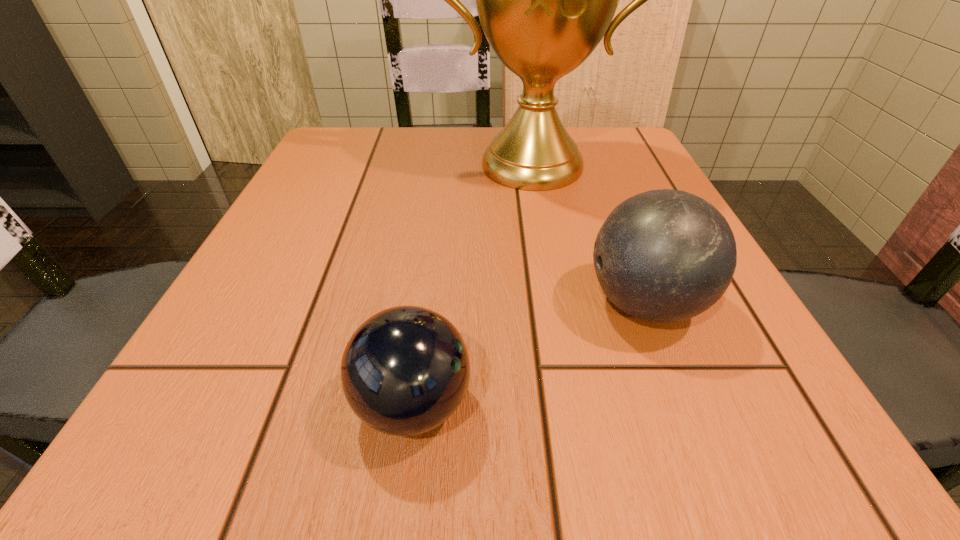
Identify the location of vacant space positioned 0.230m on the side of the nearest object with the finger holes. Image resolution: width=960 pixels, height=540 pixels. (669, 404).

You are a GUI agent. You are given a task and a screenshot of the screen. Output one action in this format:
    pyautogui.click(x=<x>, y=<y>)
    Task: Click on the object that is at the far edge
    The width and height of the screenshot is (960, 540).
    Given the screenshot: What is the action you would take?
    pyautogui.click(x=545, y=0)

Find the location of a particular element. The image size is (960, 540). object located in the near edge section of the desktop is located at coordinates (405, 370).

This screenshot has height=540, width=960. I want to click on trophy cup at the right edge, so click(x=545, y=0).

Find the location of a particular element. Image resolution: width=960 pixels, height=540 pixels. bowling ball that is at the right edge is located at coordinates (665, 255).

At what (x,y) coordinates should I click in order to perform the action: click on object located in the far right corner section of the desktop. Please return your answer as a coordinate pair (x, y). Looking at the image, I should click on (545, 0).

In the image, there is a desktop. Find the location of `vacant region at the far edge`. vacant region at the far edge is located at coordinates (x=458, y=135).

You are a GUI agent. You are given a task and a screenshot of the screen. Output one action in this format:
    pyautogui.click(x=<x>, y=<y>)
    Task: Click on the free space at the near edge
    
    Given the screenshot: What is the action you would take?
    pyautogui.click(x=648, y=418)

Find the location of a particular element. This screenshot has width=960, height=540. vacant space at the left edge is located at coordinates (269, 394).

The height and width of the screenshot is (540, 960). In the image, there is a desktop. What are the coordinates of `free region at the right edge` in the screenshot? It's located at click(x=612, y=206).